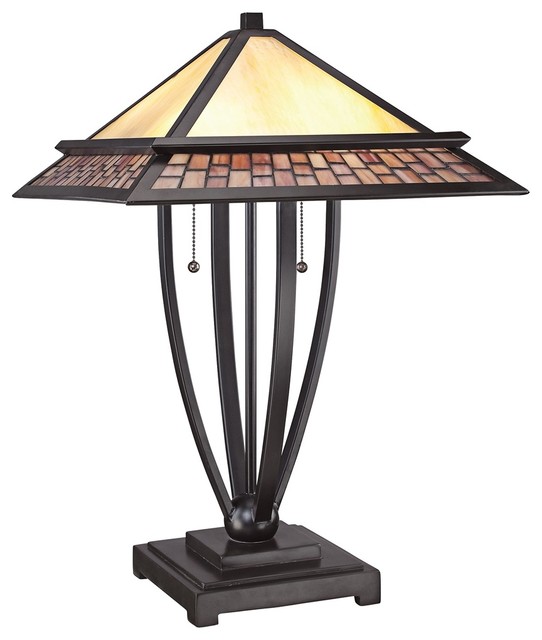
Locate an element on the screen. stand legs is located at coordinates (205, 625), (365, 602), (139, 573).